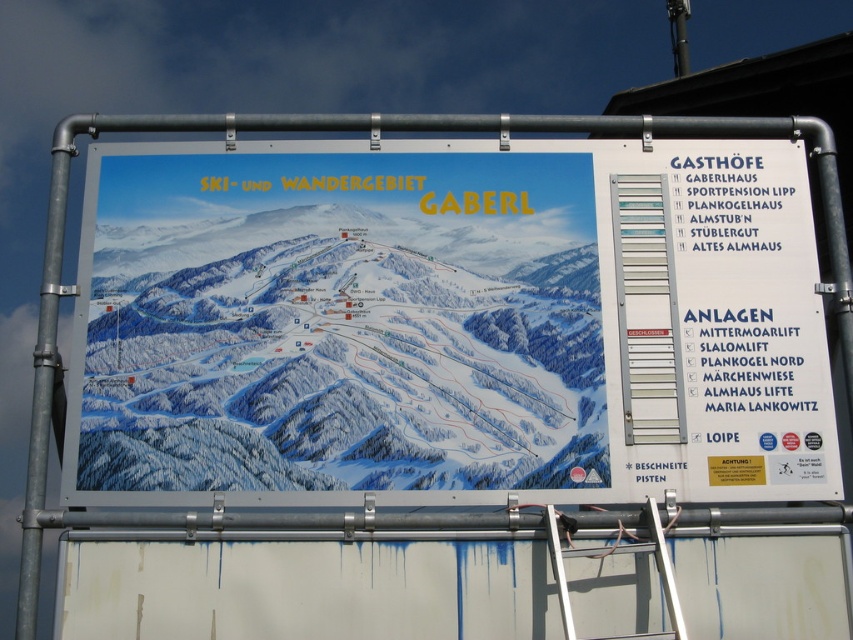
Can you confirm if silver metallic ladder at right is taller than white plastic ladder at lower center?

Yes.

From the picture: Does silver metallic ladder at right have a smaller size compared to white plastic ladder at lower center?

Correct, silver metallic ladder at right occupies less space than white plastic ladder at lower center.

Is point (636, 204) positioned before point (677, 634)?

No, (636, 204) is behind (677, 634).

This screenshot has height=640, width=853. In order to click on silver metallic ladder at right in this screenshot , I will do `click(646, 310)`.